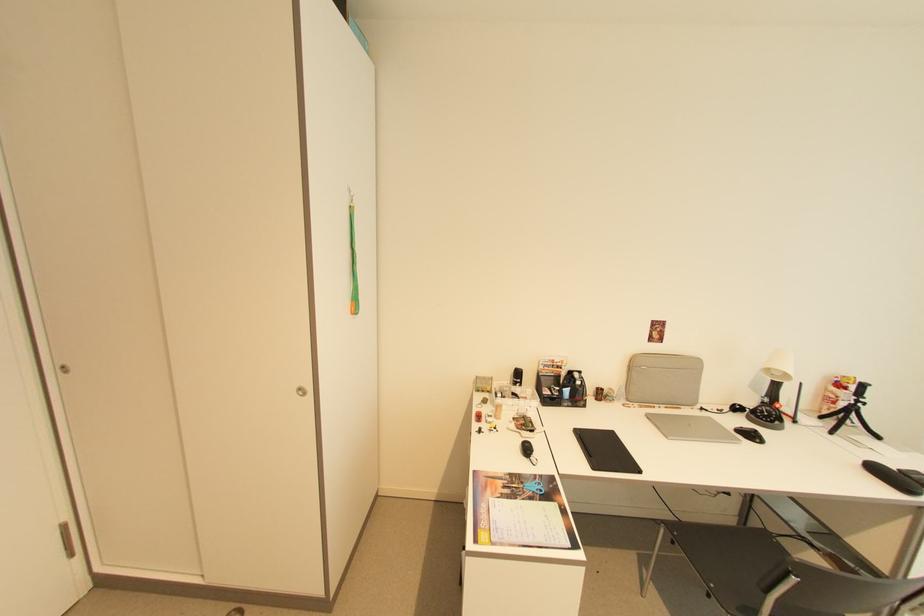
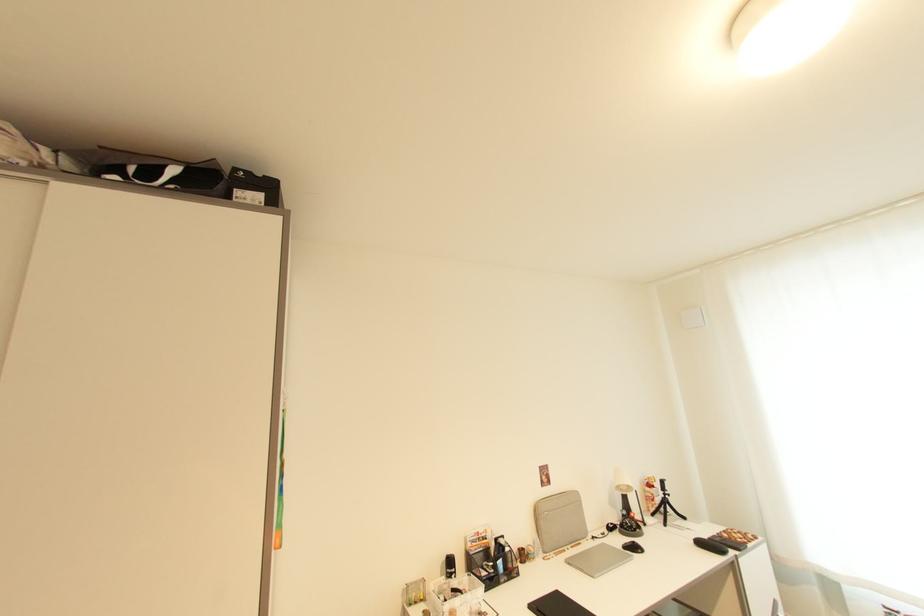
Find the pixel in the second image that matches (857,405) in the first image.

(669, 498)